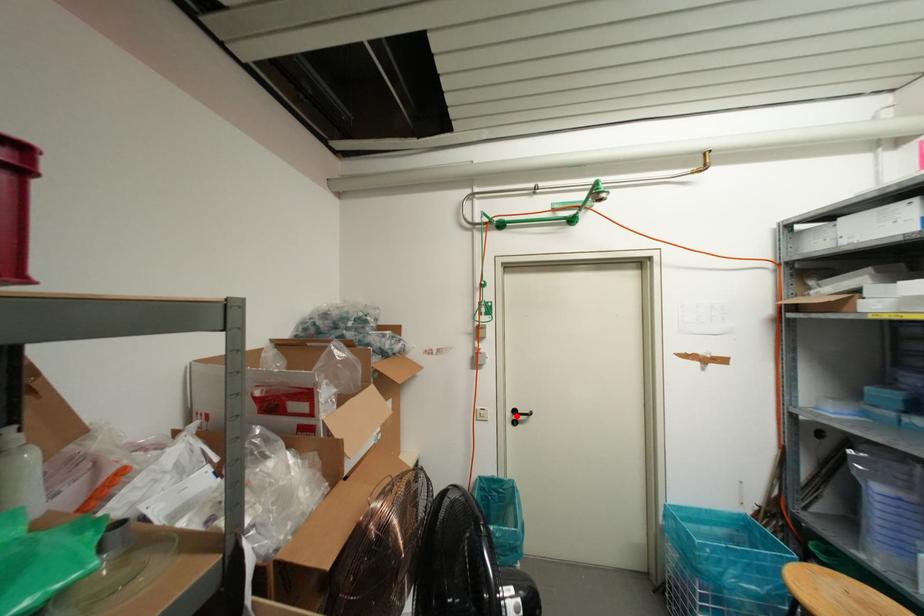
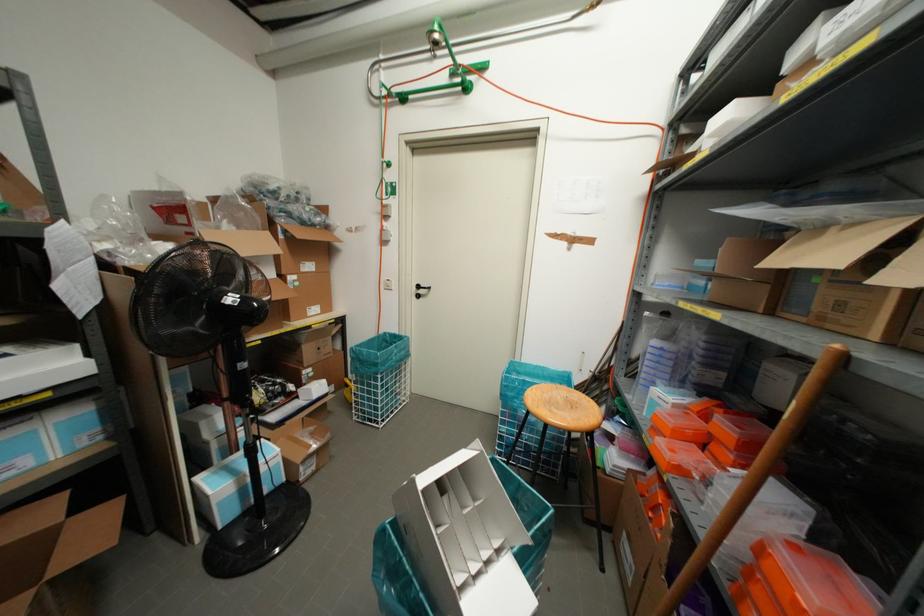
Where in the second image is the point corresponding to the highlighted location from the first image?

(419, 291)